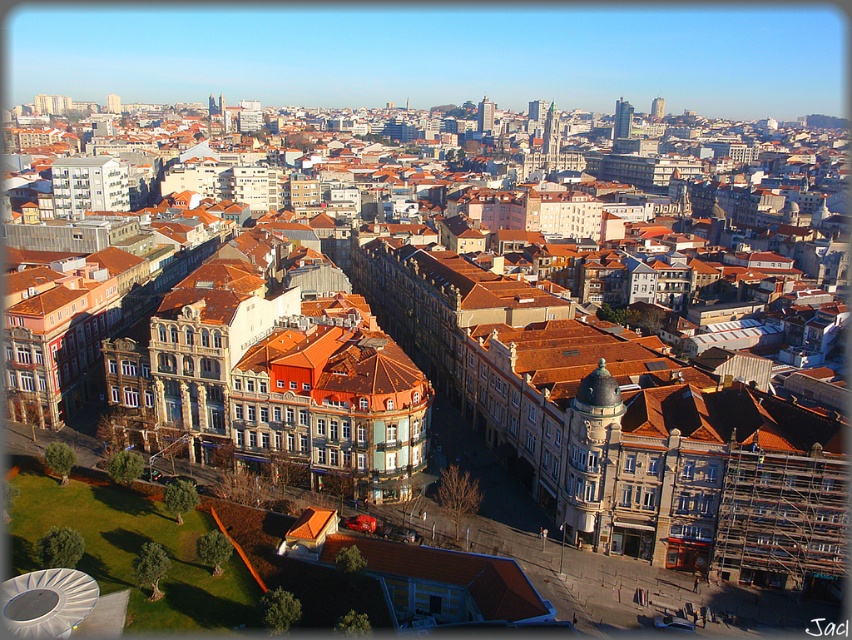
Question: Among these objects, which one is nearest to the camera?

Choices:
 (A) smooth glass skyscraper at upper center
 (B) green stone tower at center

Answer: (B)

Question: Which of the following is the closest to the observer?

Choices:
 (A) (574, 531)
 (B) (485, 100)
 (C) (557, 132)
 (D) (625, 106)

Answer: (A)

Question: Is matte copper dome at center above green stone tower at center?

Choices:
 (A) yes
 (B) no

Answer: (B)

Question: Can you confirm if smooth glass skyscraper at upper center is positioned below smooth gray tower at center?

Choices:
 (A) no
 (B) yes

Answer: (A)

Question: Is matte copper dome at center closer to the viewer compared to smooth gray tower at center?

Choices:
 (A) no
 (B) yes

Answer: (B)

Question: Among these points, which one is farthest from the camera?

Choices:
 (A) (492, 102)
 (B) (563, 524)
 (C) (547, 163)
 (D) (614, 113)

Answer: (D)